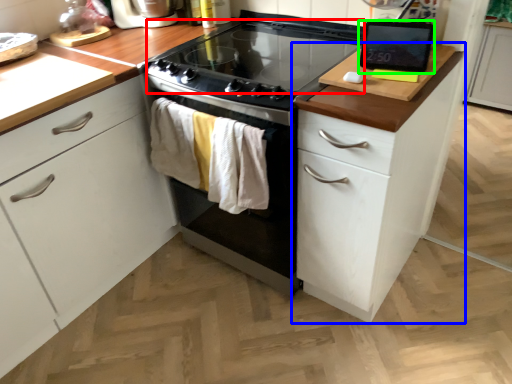
Question: Considering the real-world distances, which object is closest to gas stove (highlighted by a red box)? cabinetry (highlighted by a blue box) or kitchen appliance (highlighted by a green box).

Choices:
 (A) cabinetry
 (B) kitchen appliance

Answer: (B)